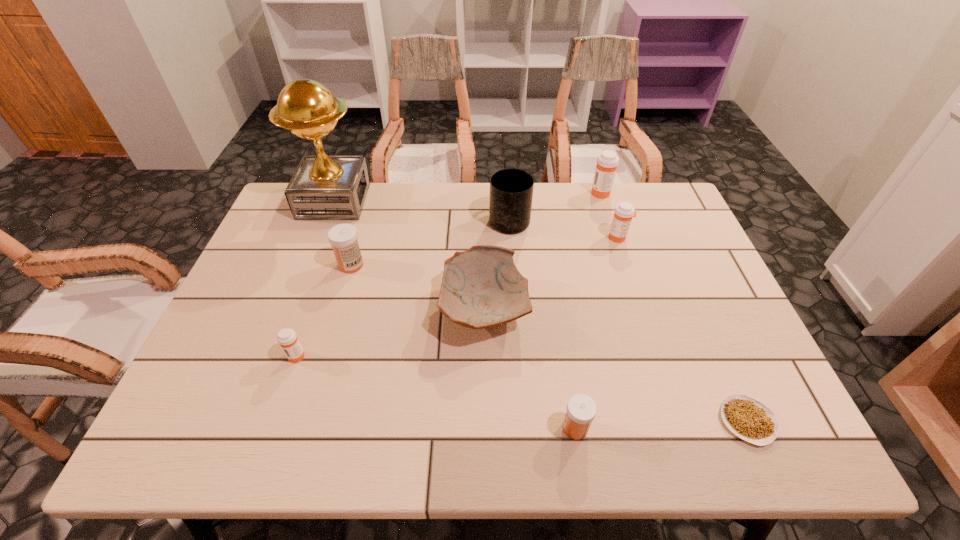
Locate an element on the screen. Image resolution: width=960 pixels, height=540 pixels. legume at the near edge is located at coordinates (748, 418).

Identify the location of object located at the left edge. (324, 187).

Locate an element on the screen. object present at the right edge is located at coordinates (748, 418).

Identify the location of object that is positioned at the far left corner. Image resolution: width=960 pixels, height=540 pixels. (324, 187).

You are a GUI agent. You are given a task and a screenshot of the screen. Output one action in this format:
    pyautogui.click(x=<x>, y=<y>)
    Task: Click on the object positioned at the near right corner
    
    Given the screenshot: What is the action you would take?
    pyautogui.click(x=748, y=418)

Locate an element on the screen. free location at the far edge is located at coordinates (587, 215).

I want to click on free space at the near edge of the desktop, so click(x=551, y=433).

Locate an element on the screen. free region at the left edge of the desktop is located at coordinates (222, 356).

I want to click on free space at the right edge of the desktop, so click(x=720, y=320).

At what (x,y) coordinates should I click in order to perform the action: click on free space at the far right corner of the desktop. Please return your answer as a coordinate pair (x, y). This screenshot has width=960, height=540. Looking at the image, I should click on (659, 209).